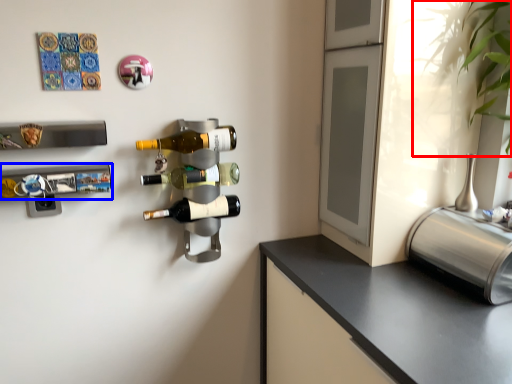
Question: Among these objects, which one is nearest to the camera, plant (highlighted by a red box) or wine rack (highlighted by a blue box)?

Choices:
 (A) plant
 (B) wine rack

Answer: (A)